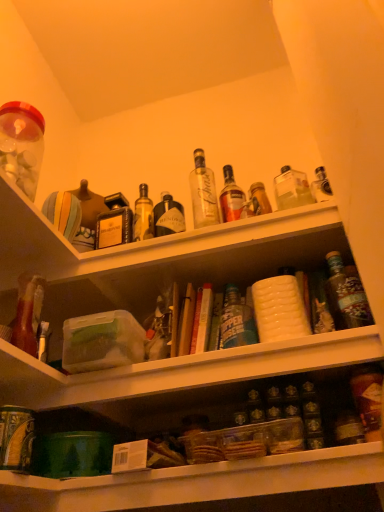
Question: Can translucent plastic jar at upper left be found inside translucent glass bottle at lower right, positioned as the second bottle in top-to-bottom order?

Choices:
 (A) no
 (B) yes

Answer: (A)

Question: Can you confirm if translucent glass bottle at lower right, marked as the 1th bottle in a front-to-back arrangement, is taller than translucent plastic jar at upper left?

Choices:
 (A) no
 (B) yes

Answer: (A)

Question: From the image's perspective, is translucent glass bottle at lower right, marked as the 1th bottle in a front-to-back arrangement, over translucent plastic jar at upper left?

Choices:
 (A) no
 (B) yes

Answer: (A)

Question: Is translucent glass bottle at lower right, which is the second bottle in back-to-front order, placed right next to translucent plastic jar at upper left?

Choices:
 (A) yes
 (B) no

Answer: (B)

Question: Is translucent glass bottle at lower right, which is the second bottle in back-to-front order, wider than translucent plastic jar at upper left?

Choices:
 (A) yes
 (B) no

Answer: (B)

Question: From the image's perspective, is translucent glass bottle at lower right, which is counted as the 1th bottle, starting from the bottom, above or below shiny dark brown bottle at right, acting as the 2th bottle starting from the bottom?

Choices:
 (A) above
 (B) below

Answer: (B)

Question: Relative to shiny dark brown bottle at right, acting as the 2th bottle starting from the bottom, is translucent glass bottle at lower right, which is the second bottle in back-to-front order, in front or behind?

Choices:
 (A) front
 (B) behind

Answer: (A)

Question: Is translucent glass bottle at lower right, which is counted as the 1th bottle, starting from the bottom, taller or shorter than shiny dark brown bottle at right, the first bottle viewed from the top?

Choices:
 (A) tall
 (B) short

Answer: (B)

Question: Is translucent glass bottle at lower right, positioned as the second bottle in top-to-bottom order, inside or outside of shiny dark brown bottle at right, the first bottle viewed from the top?

Choices:
 (A) outside
 (B) inside

Answer: (A)

Question: Is point (8, 475) positioned closer to the camera than point (360, 413)?

Choices:
 (A) closer
 (B) farther

Answer: (A)

Question: In terms of width, does clear plastic container at center, arranged as the second shelf when viewed from the top, look wider or thinner when compared to translucent glass bottle at lower right, which is counted as the 1th bottle, starting from the bottom?

Choices:
 (A) wide
 (B) thin

Answer: (A)

Question: Looking at the image, does clear plastic container at center, positioned as the 1th shelf in bottom-to-top order, seem bigger or smaller compared to translucent glass bottle at lower right, which is the second bottle in back-to-front order?

Choices:
 (A) big
 (B) small

Answer: (A)

Question: From the image's perspective, is clear plastic container at center, positioned as the 1th shelf in bottom-to-top order, located above or below translucent glass bottle at lower right, which is counted as the 1th bottle, starting from the bottom?

Choices:
 (A) below
 (B) above

Answer: (A)

Question: Is translucent plastic jar at upper left inside or outside of clear plastic container at center, positioned as the 1th shelf in bottom-to-top order?

Choices:
 (A) inside
 (B) outside

Answer: (B)

Question: Considering their positions, is translucent plastic jar at upper left located in front of or behind clear plastic container at center, positioned as the 1th shelf in bottom-to-top order?

Choices:
 (A) front
 (B) behind

Answer: (B)